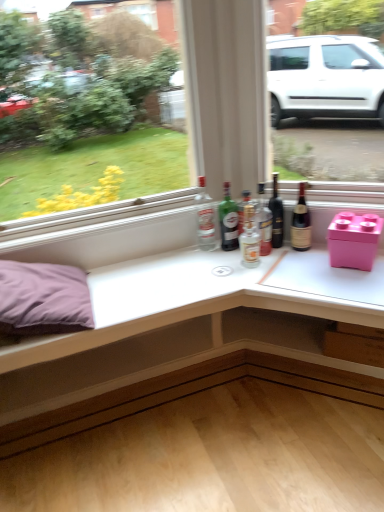
The width and height of the screenshot is (384, 512). I want to click on vacant space to the right of translucent glass bottle at center, the fourth bottle from the left, so click(x=297, y=254).